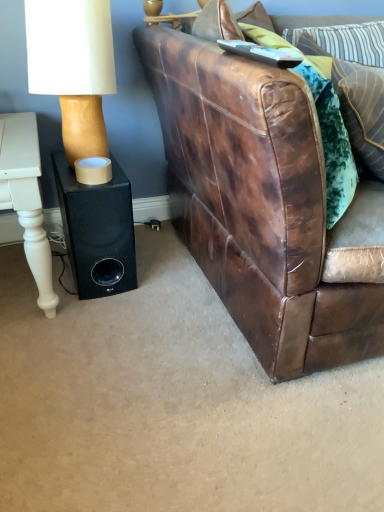
Question: Is brown leather couch at right placed right next to velvet green pillow at upper right, the 1th pillow ordered from the bottom?

Choices:
 (A) no
 (B) yes

Answer: (A)

Question: Can velvet green pillow at upper right, which is counted as the 3th pillow, starting from the top, be found inside brown leather couch at right?

Choices:
 (A) yes
 (B) no

Answer: (A)

Question: Can you confirm if brown leather couch at right is wider than velvet green pillow at upper right, the 1th pillow ordered from the bottom?

Choices:
 (A) no
 (B) yes

Answer: (B)

Question: Considering the relative positions of brown leather couch at right and velvet green pillow at upper right, the 1th pillow ordered from the bottom, in the image provided, is brown leather couch at right to the left of velvet green pillow at upper right, the 1th pillow ordered from the bottom, from the viewer's perspective?

Choices:
 (A) no
 (B) yes

Answer: (A)

Question: Would you say brown leather couch at right is a long distance from velvet green pillow at upper right, the 1th pillow ordered from the bottom?

Choices:
 (A) yes
 (B) no

Answer: (B)

Question: In terms of width, does white matte lampshade at upper left look wider or thinner when compared to black matte speaker at lower left?

Choices:
 (A) wide
 (B) thin

Answer: (B)

Question: Considering the positions of white matte lampshade at upper left and black matte speaker at lower left in the image, is white matte lampshade at upper left bigger or smaller than black matte speaker at lower left?

Choices:
 (A) big
 (B) small

Answer: (A)

Question: Visually, is white matte lampshade at upper left positioned to the left or to the right of black matte speaker at lower left?

Choices:
 (A) right
 (B) left

Answer: (B)

Question: From the image's perspective, is white matte lampshade at upper left located above or below black matte speaker at lower left?

Choices:
 (A) above
 (B) below

Answer: (A)

Question: From a real-world perspective, is velvet green pillow at upper right, the 1th pillow ordered from the bottom, above or below brown leather couch at right?

Choices:
 (A) above
 (B) below

Answer: (A)

Question: Looking at their shapes, would you say velvet green pillow at upper right, which is counted as the 3th pillow, starting from the top, is wider or thinner than brown leather couch at right?

Choices:
 (A) thin
 (B) wide

Answer: (A)

Question: Is velvet green pillow at upper right, which is counted as the 3th pillow, starting from the top, inside or outside of brown leather couch at right?

Choices:
 (A) inside
 (B) outside

Answer: (A)

Question: Considering the positions of point (365, 143) and point (210, 49), is point (365, 143) closer or farther from the camera than point (210, 49)?

Choices:
 (A) farther
 (B) closer

Answer: (A)

Question: Considering the positions of velvet green pillow at upper right, the 1th pillow ordered from the bottom, and white painted wood table at left in the image, is velvet green pillow at upper right, the 1th pillow ordered from the bottom, taller or shorter than white painted wood table at left?

Choices:
 (A) short
 (B) tall

Answer: (B)

Question: Does point (379, 159) appear closer or farther from the camera than point (33, 265)?

Choices:
 (A) closer
 (B) farther

Answer: (A)